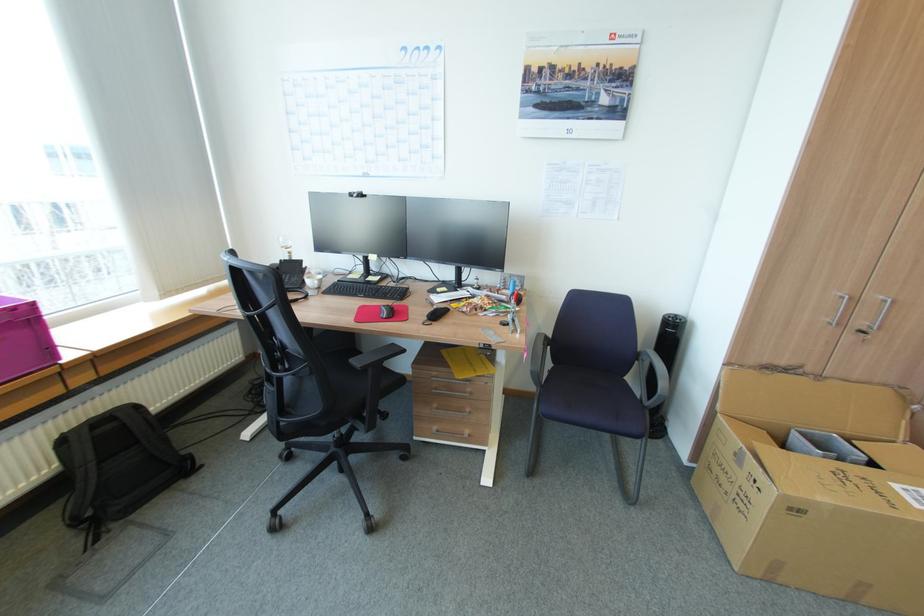
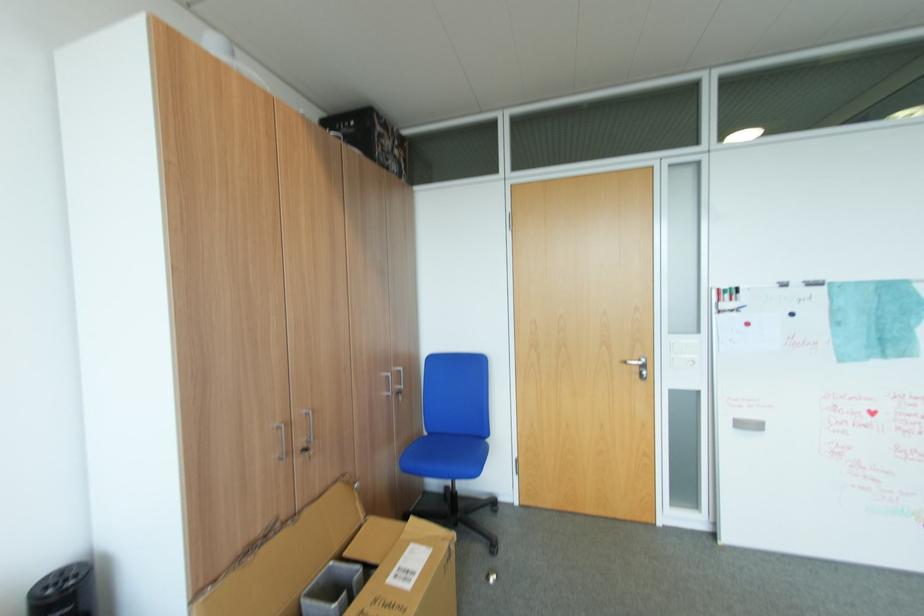
Question: I am providing you with two images of the same scene from different viewpoints. After the viewpoint changes to image2, which objects are now occluded?

Choices:
 (A) silver cabinet handle
 (B) black box
 (C) cardboard box
 (D) none of these

Answer: (D)